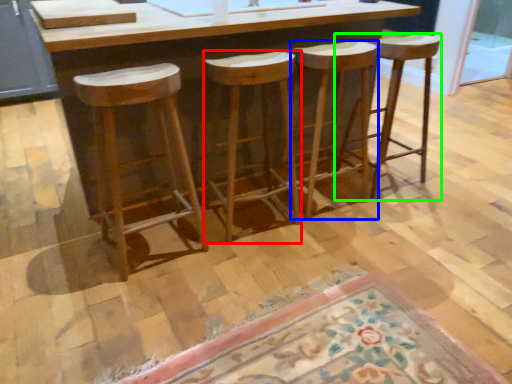
Question: Which is nearer to the stool (highlighted by a red box)? stool (highlighted by a blue box) or stool (highlighted by a green box).

Choices:
 (A) stool
 (B) stool

Answer: (A)